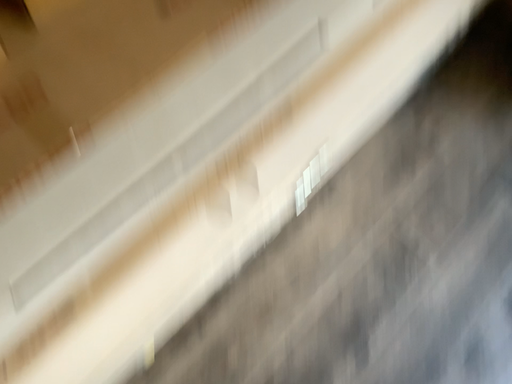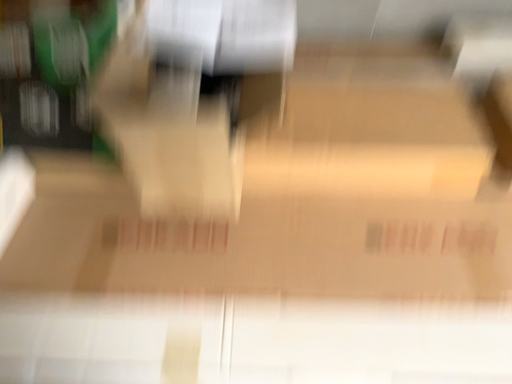
Question: How did the camera likely rotate when shooting the video?

Choices:
 (A) rotated upward
 (B) rotated downward

Answer: (A)